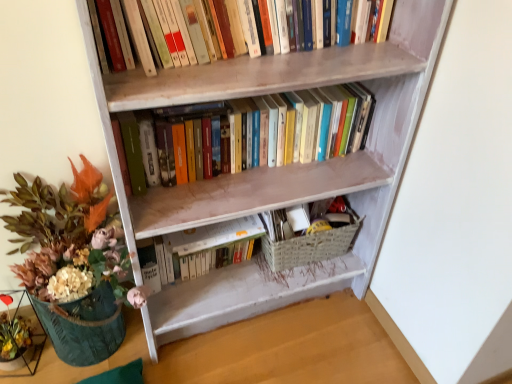
What are the coordinates of `free point below green textured vase at lower left (from a real-world perspective)` in the screenshot? It's located at (103, 352).